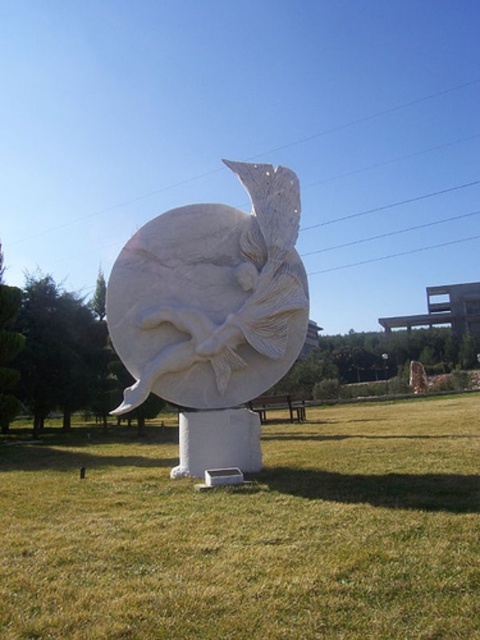
Who is shorter, green grass at center or white marble sculpture at center?

Standing shorter between the two is green grass at center.

Does point (112, 579) lie in front of point (205, 404)?

Yes.

Is point (320, 470) more distant than point (151, 385)?

Yes, point (320, 470) is behind point (151, 385).

Image resolution: width=480 pixels, height=640 pixels. Identify the location of green grass at center. (252, 534).

Can you confirm if white marble sculpture at center is thinner than brown wooden bench at center?

No.

Find the location of a particular element. white marble sculpture at center is located at coordinates click(213, 314).

Is point (291, 230) positioned after point (298, 401)?

No, it is not.

Locate an element on the screen. white marble sculpture at center is located at coordinates (213, 314).

In order to click on green grass at center in this screenshot , I will do `click(252, 534)`.

Is point (16, 458) behind point (301, 401)?

No, it is in front of (301, 401).

The width and height of the screenshot is (480, 640). Describe the element at coordinates (252, 534) in the screenshot. I see `green grass at center` at that location.

At what (x,y) coordinates should I click in order to perform the action: click on green grass at center. Please return your answer as a coordinate pair (x, y). The image size is (480, 640). Looking at the image, I should click on (252, 534).